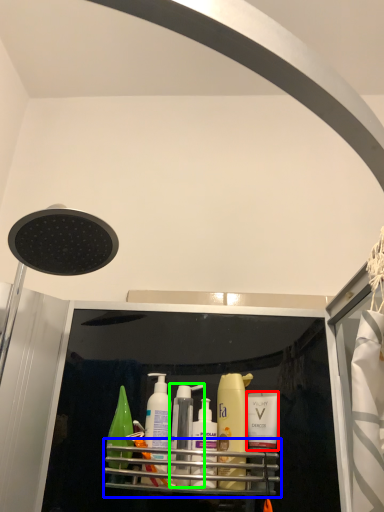
Question: Which object is the farthest from toiletry (highlighted by a red box)? Choose among these: shelf (highlighted by a blue box) or toiletry (highlighted by a green box).

Choices:
 (A) shelf
 (B) toiletry

Answer: (B)